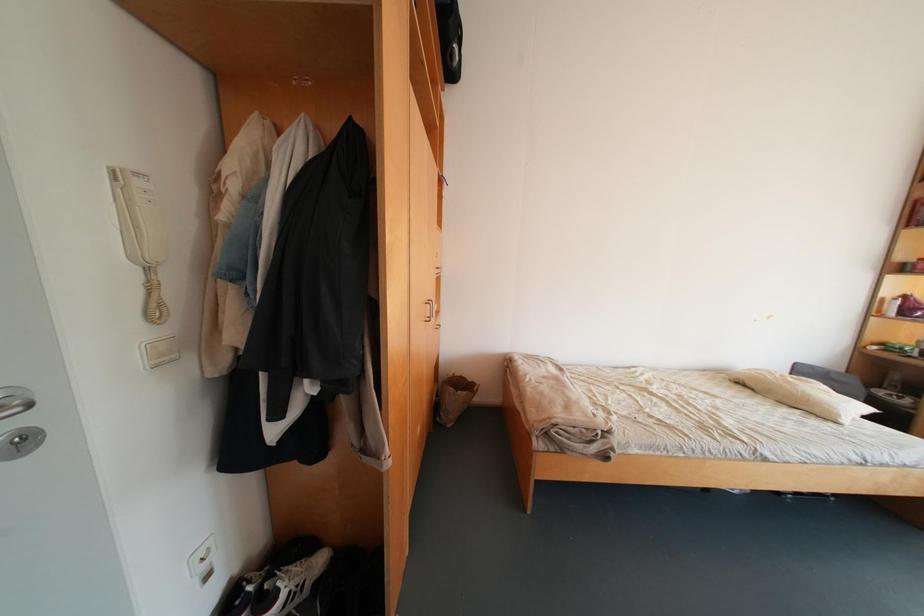
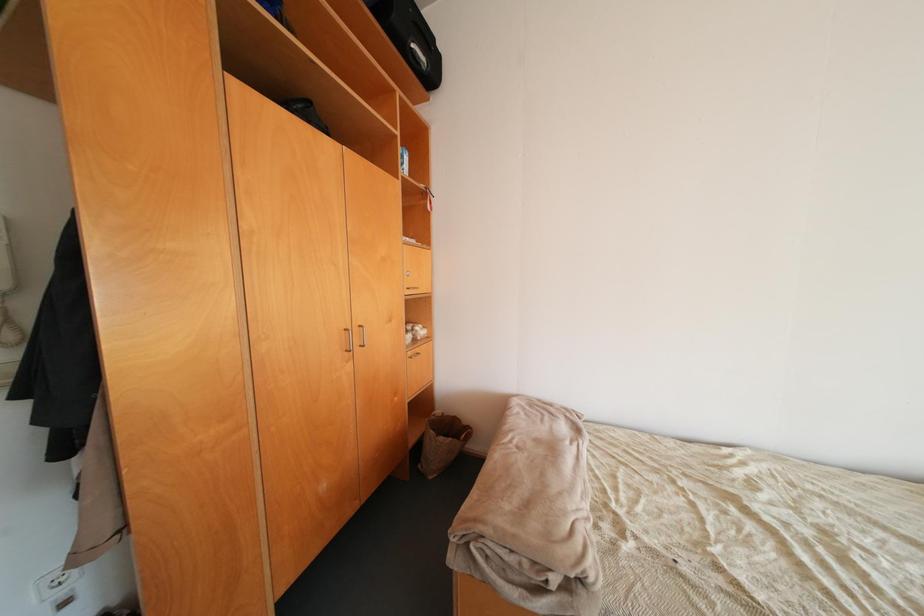
Question: Based on the continuous images, in which direction is the camera rotating? Reply with the corresponding letter.

Choices:
 (A) Left
 (B) Right
 (C) Up
 (D) Down

Answer: (A)